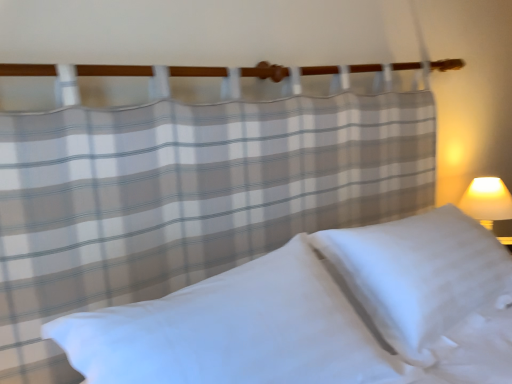
This screenshot has height=384, width=512. I want to click on white smooth pillow at center, arranged as the second pillow when viewed from the right, so click(x=236, y=331).

What do you see at coordinates (236, 331) in the screenshot? I see `white smooth pillow at center, arranged as the second pillow when viewed from the right` at bounding box center [236, 331].

What is the approximate height of white smooth pillow at center, arranged as the second pillow when viewed from the right?

The height of white smooth pillow at center, arranged as the second pillow when viewed from the right, is 12.06 inches.

What do you see at coordinates (419, 275) in the screenshot? This screenshot has height=384, width=512. I see `white soft pillow at lower right, marked as the 2th pillow in a left-to-right arrangement` at bounding box center [419, 275].

Image resolution: width=512 pixels, height=384 pixels. What are the coordinates of `white soft pillow at lower right, which is the 1th pillow from right to left` in the screenshot? It's located at (419, 275).

Measure the distance between point (453, 233) and camera.

The distance of point (453, 233) from camera is 1.44 meters.

This screenshot has width=512, height=384. I want to click on white smooth pillow at center, arranged as the second pillow when viewed from the right, so click(x=236, y=331).

Which object is positioned more to the left, white soft pillow at lower right, which is the 1th pillow from right to left, or white smooth pillow at center, the first pillow from the left?

Positioned to the left is white smooth pillow at center, the first pillow from the left.

Is white soft pillow at lower right, which is the 1th pillow from right to left, further to the viewer compared to white smooth pillow at center, arranged as the second pillow when viewed from the right?

Yes, white soft pillow at lower right, which is the 1th pillow from right to left, is behind white smooth pillow at center, arranged as the second pillow when viewed from the right.

Does point (446, 246) appear closer or farther from the camera than point (116, 343)?

Point (446, 246) is positioned farther from the camera compared to point (116, 343).

From the image's perspective, is white soft pillow at lower right, marked as the 2th pillow in a left-to-right arrangement, on top of white smooth pillow at center, the first pillow from the left?

Yes, from the image's perspective, white soft pillow at lower right, marked as the 2th pillow in a left-to-right arrangement, is over white smooth pillow at center, the first pillow from the left.

From a real-world perspective, which object rests below the other?

white soft pillow at lower right, marked as the 2th pillow in a left-to-right arrangement.

Consider the image. Considering the sizes of objects white soft pillow at lower right, which is the 1th pillow from right to left, and white smooth pillow at center, the first pillow from the left, in the image provided, who is thinner, white soft pillow at lower right, which is the 1th pillow from right to left, or white smooth pillow at center, the first pillow from the left,?

white soft pillow at lower right, which is the 1th pillow from right to left, is thinner.

Is white soft pillow at lower right, marked as the 2th pillow in a left-to-right arrangement, taller or shorter than white smooth pillow at center, arranged as the second pillow when viewed from the right?

white soft pillow at lower right, marked as the 2th pillow in a left-to-right arrangement, is taller than white smooth pillow at center, arranged as the second pillow when viewed from the right.

Who is bigger, white soft pillow at lower right, marked as the 2th pillow in a left-to-right arrangement, or white smooth pillow at center, arranged as the second pillow when viewed from the right?

Bigger between the two is white soft pillow at lower right, marked as the 2th pillow in a left-to-right arrangement.

Would you say white soft pillow at lower right, marked as the 2th pillow in a left-to-right arrangement, is outside white smooth pillow at center, arranged as the second pillow when viewed from the right?

Yes, white soft pillow at lower right, marked as the 2th pillow in a left-to-right arrangement, is not within white smooth pillow at center, arranged as the second pillow when viewed from the right.

Are white soft pillow at lower right, marked as the 2th pillow in a left-to-right arrangement, and white smooth pillow at center, arranged as the second pillow when viewed from the right, beside each other?

No, white soft pillow at lower right, marked as the 2th pillow in a left-to-right arrangement, is not in contact with white smooth pillow at center, arranged as the second pillow when viewed from the right.

Is white soft pillow at lower right, which is the 1th pillow from right to left, oriented away from white smooth pillow at center, arranged as the second pillow when viewed from the right?

No, white soft pillow at lower right, which is the 1th pillow from right to left,'s orientation is not away from white smooth pillow at center, arranged as the second pillow when viewed from the right.

The image size is (512, 384). Identify the location of pillow that appears below the white soft pillow at lower right, which is the 1th pillow from right to left (from the image's perspective). (236, 331).

Is white smooth pillow at center, arranged as the second pillow when viewed from the right, to the left or to the right of white soft pillow at lower right, marked as the 2th pillow in a left-to-right arrangement, in the image?

In the image, white smooth pillow at center, arranged as the second pillow when viewed from the right, appears on the left side of white soft pillow at lower right, marked as the 2th pillow in a left-to-right arrangement.

Is the depth of white smooth pillow at center, the first pillow from the left, less than that of white soft pillow at lower right, which is the 1th pillow from right to left?

Yes, the depth of white smooth pillow at center, the first pillow from the left, is less than that of white soft pillow at lower right, which is the 1th pillow from right to left.

Considering the positions of points (295, 236) and (428, 347), is point (295, 236) closer to camera compared to point (428, 347)?

That is False.

From the image's perspective, between white smooth pillow at center, arranged as the second pillow when viewed from the right, and white soft pillow at lower right, marked as the 2th pillow in a left-to-right arrangement, who is located below?

white smooth pillow at center, arranged as the second pillow when viewed from the right, is shown below in the image.

From the picture: From a real-world perspective, relative to white soft pillow at lower right, which is the 1th pillow from right to left, is white smooth pillow at center, arranged as the second pillow when viewed from the right, vertically above or below?

Clearly, from a real-world perspective, white smooth pillow at center, arranged as the second pillow when viewed from the right, is above white soft pillow at lower right, which is the 1th pillow from right to left.

Considering the relative sizes of white smooth pillow at center, arranged as the second pillow when viewed from the right, and white soft pillow at lower right, marked as the 2th pillow in a left-to-right arrangement, in the image provided, is white smooth pillow at center, arranged as the second pillow when viewed from the right, wider than white soft pillow at lower right, marked as the 2th pillow in a left-to-right arrangement,?

Correct, the width of white smooth pillow at center, arranged as the second pillow when viewed from the right, exceeds that of white soft pillow at lower right, marked as the 2th pillow in a left-to-right arrangement.

Who is taller, white smooth pillow at center, arranged as the second pillow when viewed from the right, or white soft pillow at lower right, marked as the 2th pillow in a left-to-right arrangement?

Standing taller between the two is white soft pillow at lower right, marked as the 2th pillow in a left-to-right arrangement.

Is white smooth pillow at center, the first pillow from the left, bigger than white soft pillow at lower right, which is the 1th pillow from right to left?

Incorrect, white smooth pillow at center, the first pillow from the left, is not larger than white soft pillow at lower right, which is the 1th pillow from right to left.

Do you think white smooth pillow at center, the first pillow from the left, is within white soft pillow at lower right, marked as the 2th pillow in a left-to-right arrangement, or outside of it?

white smooth pillow at center, the first pillow from the left, is spatially situated outside white soft pillow at lower right, marked as the 2th pillow in a left-to-right arrangement.

Is white smooth pillow at center, the first pillow from the left, beside white soft pillow at lower right, which is the 1th pillow from right to left?

No, white smooth pillow at center, the first pillow from the left, is not touching white soft pillow at lower right, which is the 1th pillow from right to left.

Is white smooth pillow at center, arranged as the second pillow when viewed from the right, facing towards white soft pillow at lower right, marked as the 2th pillow in a left-to-right arrangement?

No, white smooth pillow at center, arranged as the second pillow when viewed from the right, does not turn towards white soft pillow at lower right, marked as the 2th pillow in a left-to-right arrangement.

Locate an element on the screen. The width and height of the screenshot is (512, 384). pillow below the white smooth pillow at center, arranged as the second pillow when viewed from the right (from a real-world perspective) is located at coordinates (419, 275).

You are a GUI agent. You are given a task and a screenshot of the screen. Output one action in this format:
    pyautogui.click(x=<x>, y=<y>)
    Task: Click on the pillow on the right of white smooth pillow at center, the first pillow from the left
    Image resolution: width=512 pixels, height=384 pixels.
    Given the screenshot: What is the action you would take?
    tap(419, 275)

The image size is (512, 384). Find the location of `pillow behind the white smooth pillow at center, arranged as the second pillow when viewed from the right`. pillow behind the white smooth pillow at center, arranged as the second pillow when viewed from the right is located at coordinates (419, 275).